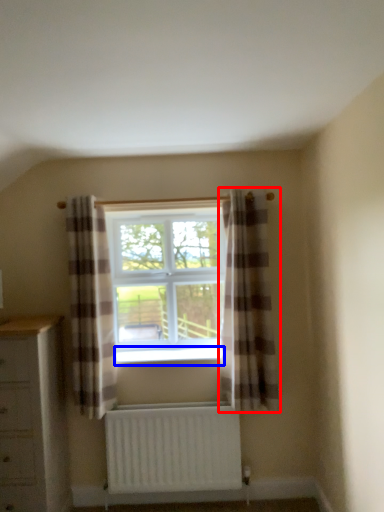
Question: Which object appears closest to the camera in this image, curtain (highlighted by a red box) or window sill (highlighted by a blue box)?

Choices:
 (A) curtain
 (B) window sill

Answer: (A)